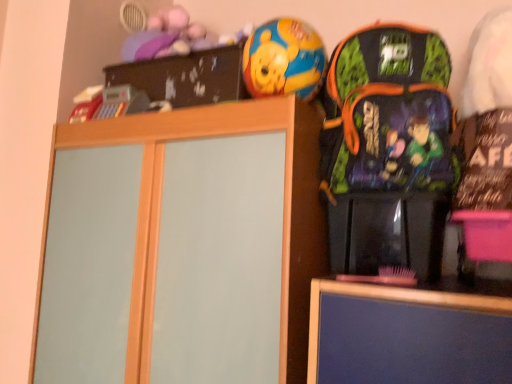
Question: Considering the relative sizes of multicolored fabric backpack at right and shiny plastic ball at upper center in the image provided, is multicolored fabric backpack at right thinner than shiny plastic ball at upper center?

Choices:
 (A) yes
 (B) no

Answer: (B)

Question: Is multicolored fabric backpack at right closer to the viewer compared to shiny plastic ball at upper center?

Choices:
 (A) no
 (B) yes

Answer: (B)

Question: Is multicolored fabric backpack at right positioned far away from shiny plastic ball at upper center?

Choices:
 (A) no
 (B) yes

Answer: (A)

Question: Does multicolored fabric backpack at right have a smaller size compared to shiny plastic ball at upper center?

Choices:
 (A) no
 (B) yes

Answer: (A)

Question: Considering the relative sizes of multicolored fabric backpack at right and shiny plastic ball at upper center in the image provided, is multicolored fabric backpack at right wider than shiny plastic ball at upper center?

Choices:
 (A) no
 (B) yes

Answer: (B)

Question: Is multicolored fabric backpack at right completely or partially outside of shiny plastic ball at upper center?

Choices:
 (A) no
 (B) yes

Answer: (B)

Question: Are wooden cabinet at center and shiny plastic ball at upper center far apart?

Choices:
 (A) no
 (B) yes

Answer: (A)

Question: From a real-world perspective, is wooden cabinet at center over shiny plastic ball at upper center?

Choices:
 (A) no
 (B) yes

Answer: (A)

Question: Can you confirm if wooden cabinet at center is thinner than shiny plastic ball at upper center?

Choices:
 (A) no
 (B) yes

Answer: (A)

Question: Can you confirm if wooden cabinet at center is positioned to the right of shiny plastic ball at upper center?

Choices:
 (A) no
 (B) yes

Answer: (A)

Question: Is wooden cabinet at center facing away from shiny plastic ball at upper center?

Choices:
 (A) no
 (B) yes

Answer: (A)

Question: Is wooden cabinet at center smaller than shiny plastic ball at upper center?

Choices:
 (A) no
 (B) yes

Answer: (A)

Question: Considering the relative sizes of multicolored fabric backpack at right and wooden cabinet at center in the image provided, is multicolored fabric backpack at right taller than wooden cabinet at center?

Choices:
 (A) no
 (B) yes

Answer: (A)